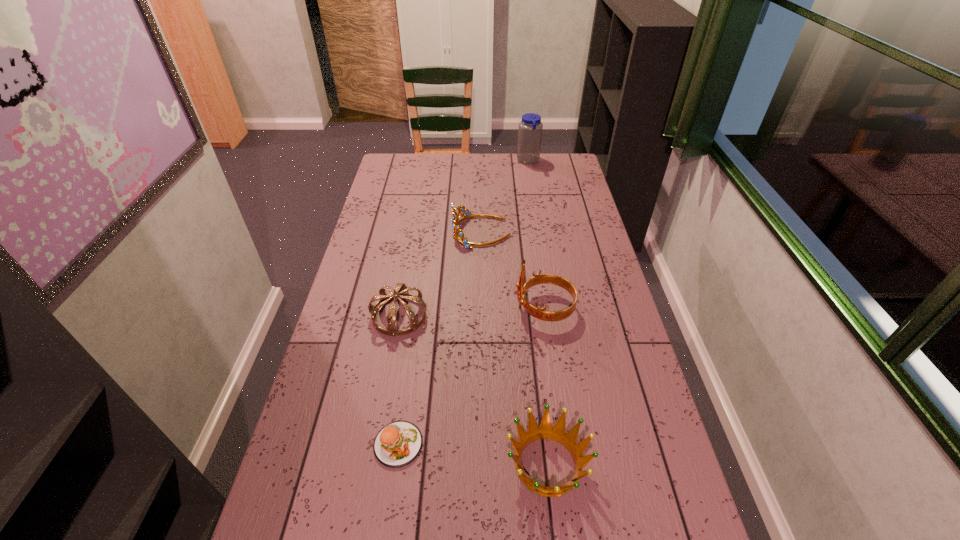
Locate an element on the screen. The image size is (960, 540). free area in between the farthest object and the patty is located at coordinates (464, 302).

Where is `free spot between the tallest tiara and the fifth tallest object`? The width and height of the screenshot is (960, 540). free spot between the tallest tiara and the fifth tallest object is located at coordinates (546, 386).

Identify the location of free point between the leftmost tiara and the crown. (473, 390).

Where is `free spot between the tallest tiara and the leftmost tiara`? This screenshot has width=960, height=540. free spot between the tallest tiara and the leftmost tiara is located at coordinates (471, 312).

Where is `object that is the closest one to the leftmost tiara`? The image size is (960, 540). object that is the closest one to the leftmost tiara is located at coordinates (458, 234).

Point out which object is positioned as the fourth nearest to the shortest object. Please provide its 2D coordinates. Your answer should be formatted as a tuple, i.e. [(x, y)], where the tuple contains the x and y coordinates of a point satisfying the conditions above.

[(458, 234)]

Where is `tiara that is the third nearest to the shortest object`? This screenshot has height=540, width=960. tiara that is the third nearest to the shortest object is located at coordinates (458, 234).

The height and width of the screenshot is (540, 960). Identify the location of tiara that stands as the second closest to the fifth nearest object. (401, 291).

Where is `free space that satisfies the following two spatial constraints: 1. on the front-facing side of the second farthest object; 2. on the front side of the leftmost tiara`? free space that satisfies the following two spatial constraints: 1. on the front-facing side of the second farthest object; 2. on the front side of the leftmost tiara is located at coordinates (481, 316).

Locate an element on the screen. Image resolution: width=960 pixels, height=540 pixels. free location that satisfies the following two spatial constraints: 1. on the front-facing side of the fifth tallest object; 2. on the right side of the fifth nearest object is located at coordinates (482, 464).